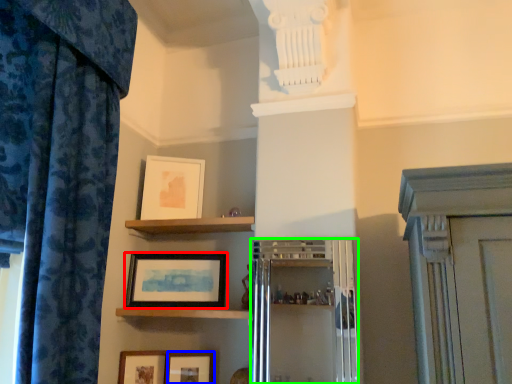
Question: Estimate the real-world distances between objects in this image. Which object is farther from picture frame (highlighted by a red box), picture frame (highlighted by a blue box) or cabinetry (highlighted by a green box)?

Choices:
 (A) picture frame
 (B) cabinetry

Answer: (B)